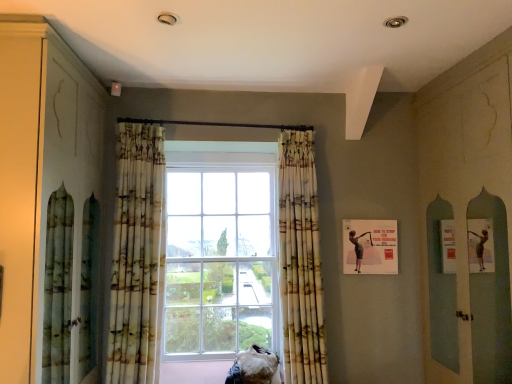
In order to face matte paper poster at right, should I rotate leftwards or rightwards?

You should rotate right by 15.085 degrees.

What is the approximate height of printed fabric curtain at center, marked as the first curtain in a left-to-right arrangement?

It is 6.11 feet.

How much space does printed fabric curtain at center, the second curtain in the left-to-right sequence, occupy horizontally?

printed fabric curtain at center, the second curtain in the left-to-right sequence, is 37.24 centimeters in width.

Locate an element on the screen. The width and height of the screenshot is (512, 384). matte paper poster at right is located at coordinates (370, 246).

Is the position of printed fabric curtain at center, which is the 1th curtain from right to left, less distant than that of matte green cabinet at left?

No, printed fabric curtain at center, which is the 1th curtain from right to left, is further to the viewer.

From the picture: How many degrees apart are the facing directions of printed fabric curtain at center, the second curtain in the left-to-right sequence, and matte green cabinet at left?

They differ by 94.1 degrees in their facing directions.

Is printed fabric curtain at center, the second curtain in the left-to-right sequence, completely or partially outside of matte green cabinet at left?

Indeed, printed fabric curtain at center, the second curtain in the left-to-right sequence, is completely outside matte green cabinet at left.

Could you measure the distance between printed fabric curtain at center, which is the 1th curtain from right to left, and matte green cabinet at left?

The distance of printed fabric curtain at center, which is the 1th curtain from right to left, from matte green cabinet at left is 5.14 feet.

Considering the relative sizes of matte paper poster at right and printed fabric curtain at center, the second curtain in the left-to-right sequence, in the image provided, is matte paper poster at right taller than printed fabric curtain at center, the second curtain in the left-to-right sequence,?

No.

In the scene shown: Which point is more forward, [350,254] or [283,176]?

The point [283,176] is closer.

In the scene shown: Between matte paper poster at right and printed fabric curtain at center, which is the 1th curtain from right to left, which one has smaller size?

matte paper poster at right is smaller.

Measure the distance from matte paper poster at right to printed fabric curtain at center, which is the 1th curtain from right to left.

matte paper poster at right is 48.82 centimeters from printed fabric curtain at center, which is the 1th curtain from right to left.

From the picture: Is matte green cabinet at left far from printed fabric curtain at center, which is the 1th curtain from right to left?

matte green cabinet at left is far away from printed fabric curtain at center, which is the 1th curtain from right to left.

Which is less distant, (79, 231) or (298, 329)?

The point (79, 231) is more forward.

From a real-world perspective, which curtain is the 2nd one underneath the matte green cabinet at left? Please provide its 2D coordinates.

[(300, 261)]

Is matte green cabinet at left in front of printed fabric curtain at center, the second curtain in the left-to-right sequence?

That is True.

Is matte paper poster at right surrounded by matte green cabinet at left?

No, matte paper poster at right is not a part of matte green cabinet at left.

Considering the sizes of objects matte green cabinet at left and matte paper poster at right in the image provided, who is bigger, matte green cabinet at left or matte paper poster at right?

matte green cabinet at left is bigger.

Is matte green cabinet at left oriented away from matte paper poster at right?

matte green cabinet at left does not have its back to matte paper poster at right.

From a real-world perspective, is matte green cabinet at left over matte paper poster at right?

Indeed, from a real-world perspective, matte green cabinet at left stands above matte paper poster at right.

From the picture: Is printed fabric curtain at center, which ranks as the 2th curtain in right-to-left order, shorter than matte paper poster at right?

No, printed fabric curtain at center, which ranks as the 2th curtain in right-to-left order, is not shorter than matte paper poster at right.

Is printed fabric curtain at center, marked as the first curtain in a left-to-right arrangement, aimed at matte paper poster at right?

No, printed fabric curtain at center, marked as the first curtain in a left-to-right arrangement, is not oriented towards matte paper poster at right.

Does printed fabric curtain at center, which ranks as the 2th curtain in right-to-left order, have a larger size compared to matte paper poster at right?

Yes, printed fabric curtain at center, which ranks as the 2th curtain in right-to-left order, is bigger than matte paper poster at right.

Is printed fabric curtain at center, marked as the first curtain in a left-to-right arrangement, with matte paper poster at right?

No, printed fabric curtain at center, marked as the first curtain in a left-to-right arrangement, is not next to matte paper poster at right.

Locate an element on the screen. The width and height of the screenshot is (512, 384). cabinetry located in front of the printed fabric curtain at center, which ranks as the 2th curtain in right-to-left order is located at coordinates (40, 173).

Is the depth of printed fabric curtain at center, which ranks as the 2th curtain in right-to-left order, greater than that of matte green cabinet at left?

Yes.

Is printed fabric curtain at center, marked as the first curtain in a left-to-right arrangement, turned away from matte green cabinet at left?

That's not correct — printed fabric curtain at center, marked as the first curtain in a left-to-right arrangement, is not looking away from matte green cabinet at left.

Can you confirm if printed fabric curtain at center, marked as the first curtain in a left-to-right arrangement, is thinner than matte green cabinet at left?

Yes, printed fabric curtain at center, marked as the first curtain in a left-to-right arrangement, is thinner than matte green cabinet at left.

Is printed fabric curtain at center, marked as the first curtain in a left-to-right arrangement, oriented away from printed fabric curtain at center, the second curtain in the left-to-right sequence?

No, printed fabric curtain at center, marked as the first curtain in a left-to-right arrangement, is not facing away from printed fabric curtain at center, the second curtain in the left-to-right sequence.

From the image's perspective, is printed fabric curtain at center, marked as the first curtain in a left-to-right arrangement, located above printed fabric curtain at center, which is the 1th curtain from right to left?

Indeed, from the image's perspective, printed fabric curtain at center, marked as the first curtain in a left-to-right arrangement, is shown above printed fabric curtain at center, which is the 1th curtain from right to left.

Is printed fabric curtain at center, the second curtain in the left-to-right sequence, surrounded by printed fabric curtain at center, which ranks as the 2th curtain in right-to-left order?

No, printed fabric curtain at center, the second curtain in the left-to-right sequence, is not surrounded by printed fabric curtain at center, which ranks as the 2th curtain in right-to-left order.

From a real-world perspective, is printed fabric curtain at center, marked as the first curtain in a left-to-right arrangement, on top of printed fabric curtain at center, the second curtain in the left-to-right sequence?

Yes, from a real-world perspective, printed fabric curtain at center, marked as the first curtain in a left-to-right arrangement, is on top of printed fabric curtain at center, the second curtain in the left-to-right sequence.

This screenshot has width=512, height=384. Identify the location of cabinetry on the left of printed fabric curtain at center, which is the 1th curtain from right to left. (40, 173).

Where is `poster on the right of printed fabric curtain at center, the second curtain in the left-to-right sequence`? This screenshot has height=384, width=512. poster on the right of printed fabric curtain at center, the second curtain in the left-to-right sequence is located at coordinates (370, 246).

Based on the photo, looking at the image, which one is located further to matte paper poster at right, printed fabric curtain at center, which is the 1th curtain from right to left, or printed fabric curtain at center, which ranks as the 2th curtain in right-to-left order?

printed fabric curtain at center, which ranks as the 2th curtain in right-to-left order, lies further to matte paper poster at right than the other object.

Which object lies further to the anchor point printed fabric curtain at center, the second curtain in the left-to-right sequence, matte paper poster at right or printed fabric curtain at center, marked as the first curtain in a left-to-right arrangement?

printed fabric curtain at center, marked as the first curtain in a left-to-right arrangement, is positioned further to the anchor printed fabric curtain at center, the second curtain in the left-to-right sequence.

Based on their spatial positions, is matte green cabinet at left or printed fabric curtain at center, which ranks as the 2th curtain in right-to-left order, closer to matte paper poster at right?

printed fabric curtain at center, which ranks as the 2th curtain in right-to-left order, lies closer to matte paper poster at right than the other object.

When comparing their distances from printed fabric curtain at center, marked as the first curtain in a left-to-right arrangement, does matte paper poster at right or printed fabric curtain at center, the second curtain in the left-to-right sequence, seem further?

Among the two, matte paper poster at right is located further to printed fabric curtain at center, marked as the first curtain in a left-to-right arrangement.

Looking at the image, which one is located further to printed fabric curtain at center, which is the 1th curtain from right to left, printed fabric curtain at center, which ranks as the 2th curtain in right-to-left order, or matte green cabinet at left?

The object further to printed fabric curtain at center, which is the 1th curtain from right to left, is matte green cabinet at left.

When comparing their distances from printed fabric curtain at center, the second curtain in the left-to-right sequence, does matte green cabinet at left or printed fabric curtain at center, which ranks as the 2th curtain in right-to-left order, seem closer?

Based on the image, printed fabric curtain at center, which ranks as the 2th curtain in right-to-left order, appears to be nearer to printed fabric curtain at center, the second curtain in the left-to-right sequence.

From the image, which object appears to be nearer to matte green cabinet at left, printed fabric curtain at center, marked as the first curtain in a left-to-right arrangement, or matte paper poster at right?

printed fabric curtain at center, marked as the first curtain in a left-to-right arrangement.

Which object lies further to the anchor point printed fabric curtain at center, marked as the first curtain in a left-to-right arrangement, printed fabric curtain at center, which is the 1th curtain from right to left, or matte green cabinet at left?

Among the two, printed fabric curtain at center, which is the 1th curtain from right to left, is located further to printed fabric curtain at center, marked as the first curtain in a left-to-right arrangement.

Locate an element on the screen. This screenshot has height=384, width=512. curtain located between matte green cabinet at left and printed fabric curtain at center, the second curtain in the left-to-right sequence, in the left-right direction is located at coordinates (137, 253).

The height and width of the screenshot is (384, 512). I want to click on curtain situated between printed fabric curtain at center, which ranks as the 2th curtain in right-to-left order, and matte paper poster at right from left to right, so click(x=300, y=261).